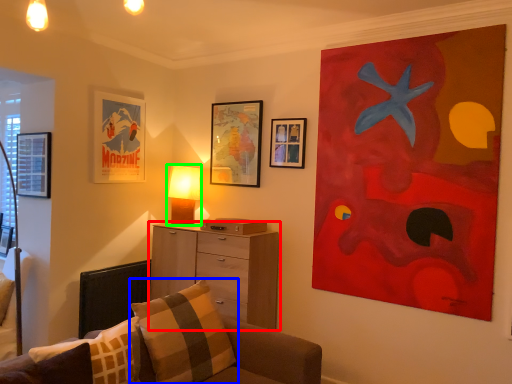
Question: Which object is the farthest from chest of drawers (highlighted by a red box)? Choose among these: pillow (highlighted by a blue box) or table lamp (highlighted by a green box).

Choices:
 (A) pillow
 (B) table lamp

Answer: (A)